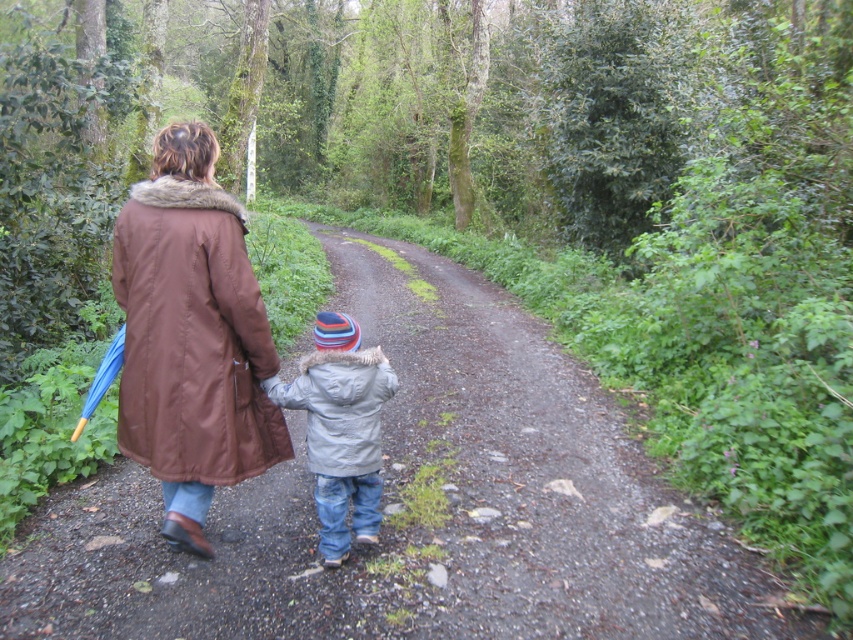
You are a hiker who needs to decide which item to take with you next. You see a brown synthetic coat at back and a gray fleece jacket at center. Which one is closer to your current position?

The brown synthetic coat at back is to the left of the gray fleece jacket at center, so the gray fleece jacket at center is closer to your current position.

You are a hiker planning to walk along the narrow dirt path in the image. You see a brown synthetic coat at back and a gray fleece jacket at center. Which clothing item is closer to you?

The gray fleece jacket at center is closer to you because the brown synthetic coat at back is positioned over it, meaning it is further away.

You are planning to take a photo of the scene with the brown synthetic coat at back. To ensure the coat is in focus, where should you position the camera relative to the other elements in the scene?

The brown synthetic coat at back is located at point (x=192, y=337), so you should position the camera to focus on that coordinate to ensure the coat is in focus.